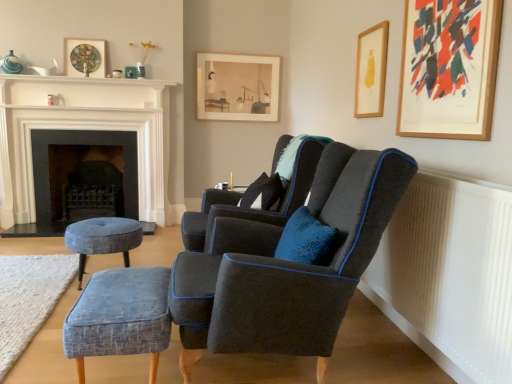
This screenshot has width=512, height=384. I want to click on free space above textured blue fabric stool at lower left, acting as the first stool starting from the right (from a real-world perspective), so click(117, 288).